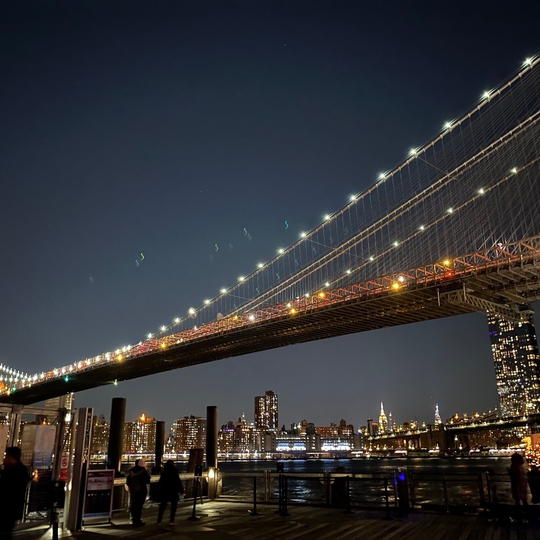
This screenshot has width=540, height=540. I want to click on light, so click(x=262, y=261).